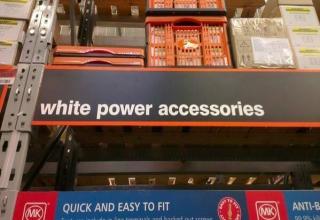
The height and width of the screenshot is (220, 320). What are the coordinates of `metal shelf columns` in the screenshot? It's located at (32, 87), (23, 81), (30, 48), (37, 46), (25, 141), (5, 136), (70, 148), (86, 26).